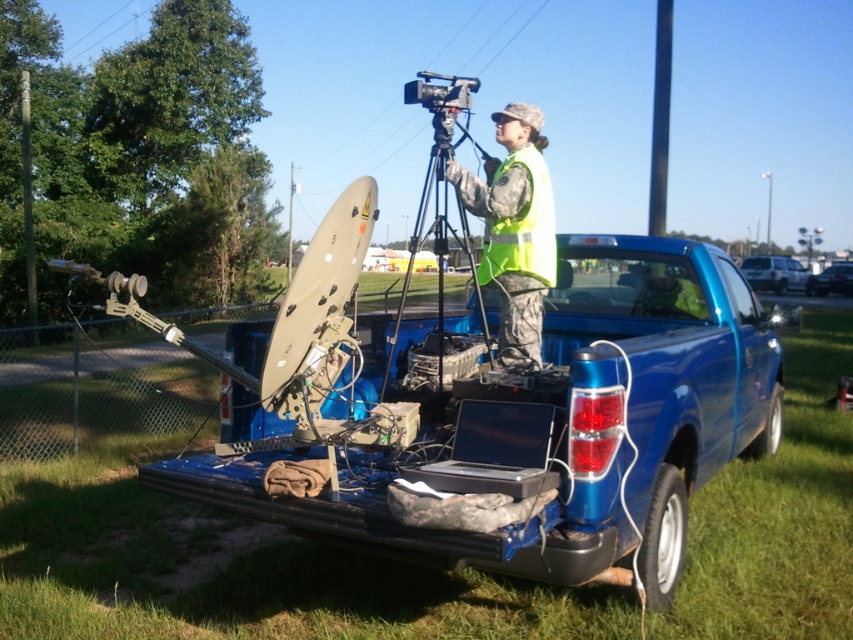
Question: Considering the relative positions of yellow reflective vest at center and metallic wire at upper center in the image provided, where is yellow reflective vest at center located with respect to metallic wire at upper center?

Choices:
 (A) right
 (B) left

Answer: (A)

Question: Can you confirm if metallic tripod at center is thinner than yellow reflective safety vest at center?

Choices:
 (A) no
 (B) yes

Answer: (A)

Question: Which object is farther from the camera taking this photo?

Choices:
 (A) yellow reflective vest at center
 (B) metallic tripod at center
 (C) yellow reflective safety vest at center

Answer: (C)

Question: Which is farther from the matte black video camera at center?

Choices:
 (A) yellow reflective safety vest at center
 (B) yellow reflective vest at center
 (C) metallic tripod at center

Answer: (C)

Question: Which object is farther from the camera taking this photo?

Choices:
 (A) metallic tripod at center
 (B) matte black video camera at center

Answer: (B)

Question: Is metallic wire at upper center further to the viewer compared to matte black video camera at center?

Choices:
 (A) yes
 (B) no

Answer: (A)